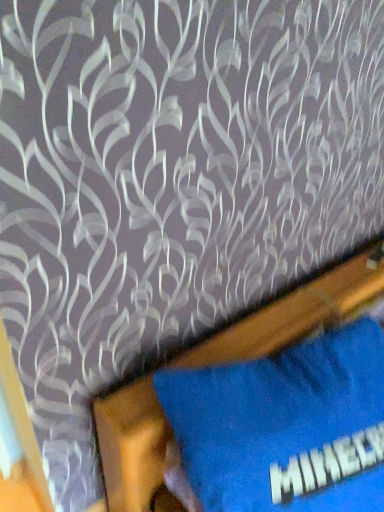
Measure the distance between blue fabric cushion at lower right and camera.

A distance of 1.06 meters exists between blue fabric cushion at lower right and camera.

This screenshot has height=512, width=384. What do you see at coordinates (295, 313) in the screenshot?
I see `blue fabric cushion at lower right` at bounding box center [295, 313].

Image resolution: width=384 pixels, height=512 pixels. In order to click on blue fabric cushion at lower right in this screenshot , I will do `click(295, 313)`.

This screenshot has height=512, width=384. I want to click on blue fabric cushion at lower right, so click(x=295, y=313).